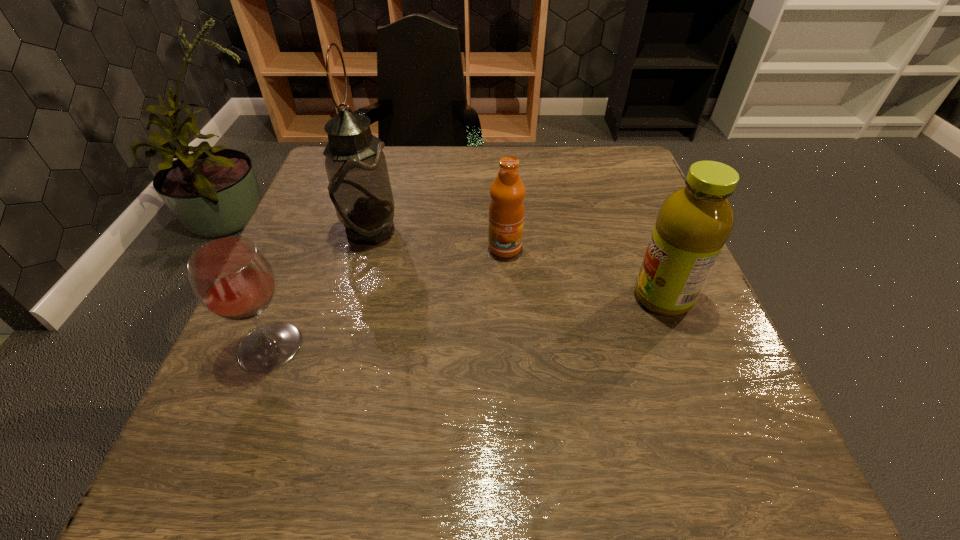
What are the coordinates of `unoccupied area between the nearest object and the second object from right to left` in the screenshot? It's located at (388, 297).

Locate an element on the screen. The height and width of the screenshot is (540, 960). free spot between the tallest object and the taller fruit juice is located at coordinates (516, 265).

Find the location of a particular element. object identified as the closest to the wineglass is located at coordinates (359, 186).

Locate an element on the screen. This screenshot has height=540, width=960. object that stands as the second closest to the oil lamp is located at coordinates (506, 210).

Find the location of a particular element. This screenshot has height=540, width=960. free spot that satisfies the following two spatial constraints: 1. on the back side of the wineglass; 2. on the left side of the tallest object is located at coordinates (318, 231).